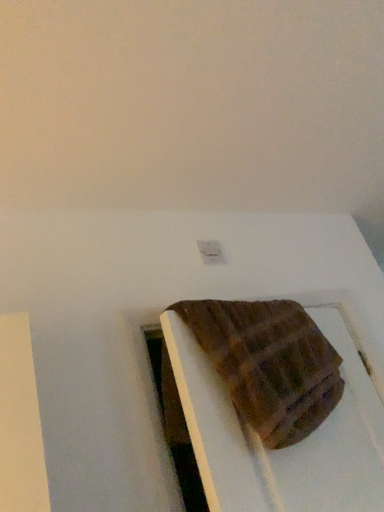
What is the approximate width of brown textured towel at center?

6.97 inches.

The width and height of the screenshot is (384, 512). Find the location of `brown textured towel at center`. brown textured towel at center is located at coordinates (268, 362).

Describe the element at coordinates (268, 362) in the screenshot. I see `brown textured towel at center` at that location.

At what (x,y) coordinates should I click in order to perform the action: click on brown textured towel at center. Please return your answer as a coordinate pair (x, y). The width and height of the screenshot is (384, 512). Looking at the image, I should click on (268, 362).